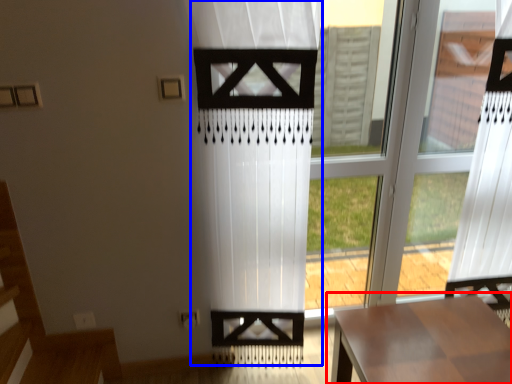
Question: Among these objects, which one is farthest to the camera, table (highlighted by a red box) or curtain (highlighted by a blue box)?

Choices:
 (A) table
 (B) curtain

Answer: (A)